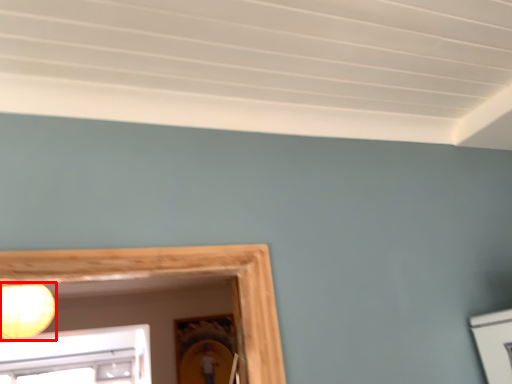
Question: From the image's perspective, where is lamp (annotated by the red box) located relative to picture frame?

Choices:
 (A) below
 (B) above

Answer: (B)